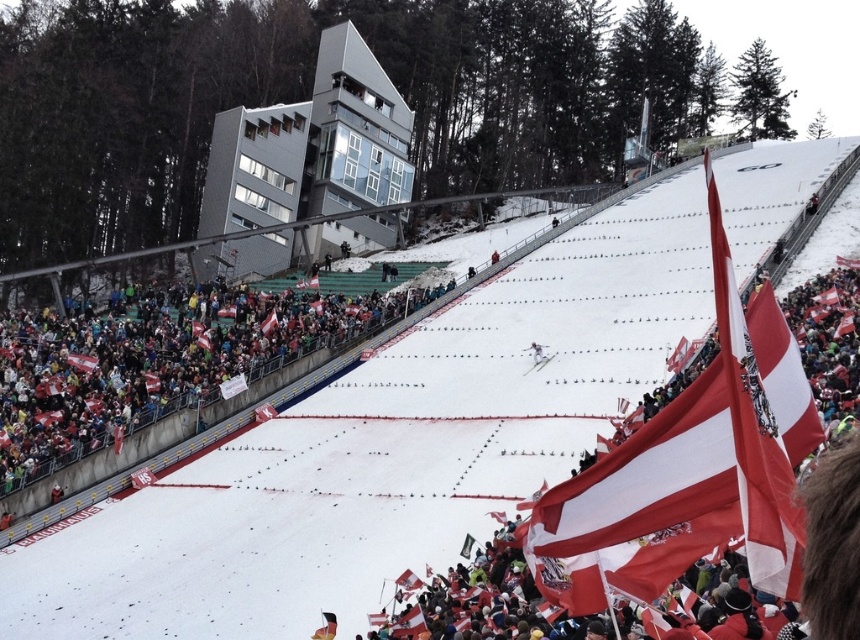
Question: Which point is closer to the camera?

Choices:
 (A) (545, 346)
 (B) (229, 168)

Answer: (A)

Question: Is red/white fabric flag at lower right to the left of metallic gray building at upper center from the viewer's perspective?

Choices:
 (A) yes
 (B) no

Answer: (B)

Question: Which of the following is the farthest from the observer?

Choices:
 (A) white snow at lower left
 (B) red/white fabric flag at lower right
 (C) white glossy snowboarder at center
 (D) metallic gray building at upper center

Answer: (D)

Question: Does white snow at lower left appear on the left side of white glossy snowboarder at center?

Choices:
 (A) no
 (B) yes

Answer: (B)

Question: Can you confirm if metallic gray building at upper center is wider than white glossy snowboarder at center?

Choices:
 (A) no
 (B) yes

Answer: (B)

Question: Estimate the real-world distances between objects in this image. Which object is closer to the white glossy snowboarder at center?

Choices:
 (A) white snow at lower left
 (B) metallic gray building at upper center
 (C) red/white fabric flag at lower right

Answer: (C)